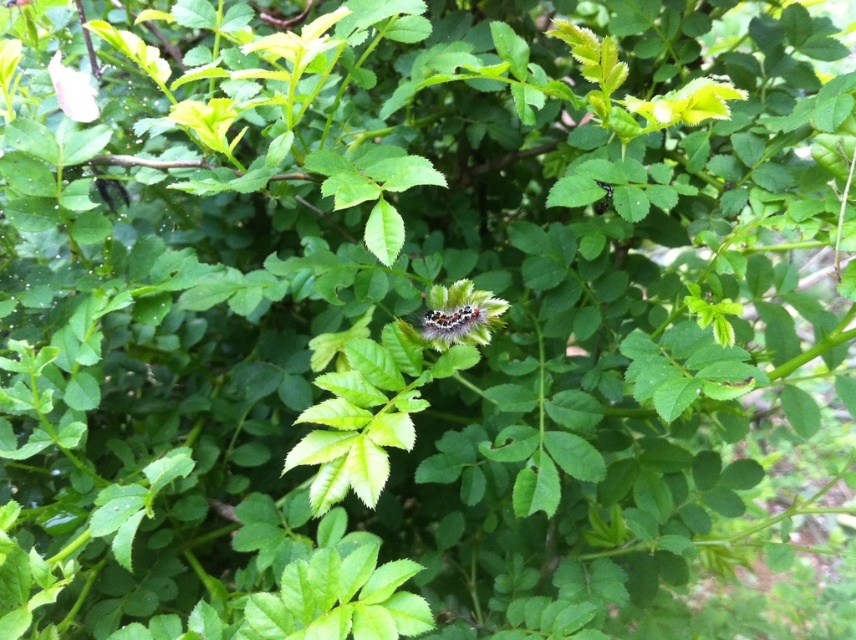
You are a gardener observing this plant. You notice the fluffy multicolored caterpillar at center and the smooth pink petal at upper left. Which object is positioned higher up in the image?

The smooth pink petal at upper left is positioned higher up in the image than the fluffy multicolored caterpillar at center.

You are a gardener who wants to place a small decorative stone between the green fuzzy leaf at upper center and the smooth pink petal at upper left. The stone is 12 inches long. Will there be enough space for the stone between them?

The green fuzzy leaf at upper center is 33.78 inches away from the smooth pink petal at upper left. Since the stone is only 12 inches long, there is sufficient space to place it between them.